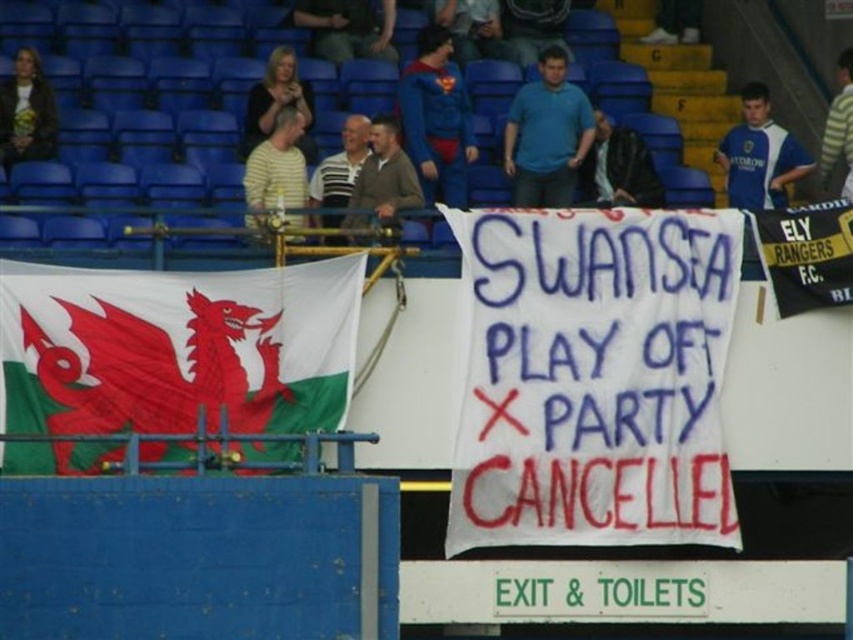
You are a photographer trying to capture the banner with the red dragon flag in the background. Where should you position yourself relative to the point at coordinates (595, 378) to ensure both the banner and the flag are in frame?

The point at coordinates (595, 378) is on the white fabric banner at center. To include both the banner and the flag to the left of the banner in your photo, position yourself to the right of the point at coordinates (595, 378) so that the banner remains centered and the flag stays within the frame.

You are a photographer at the stadium and want to capture both the white fabric banner at center and the black jersey at right in a single shot. Which object should you position closer to the left side of your camera frame?

The white fabric banner at center should be positioned closer to the left side of your camera frame because it is located to the left of the black jersey at right.

You are a photographer at the stadium and want to capture the white fabric banner at center in your photo. If your camera has a zoom lens that can focus on objects within a 0.5 unit radius, will you be able to clearly capture the banner at its current position?

The white fabric banner at center is located at point (595, 378). Since the camera can focus on objects within a 0.5 unit radius, and the banner is within that range, yes, you can clearly capture the banner at its current position.